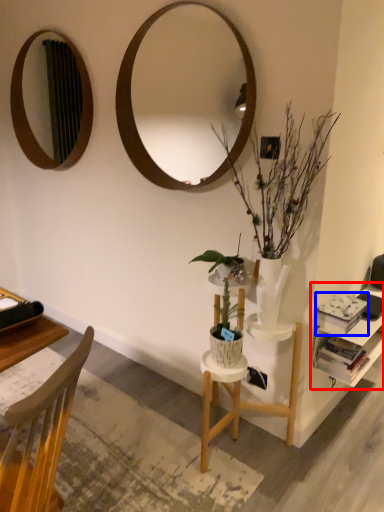
Question: Among these objects, which one is nearest to the camera, shelf (highlighted by a red box) or book (highlighted by a blue box)?

Choices:
 (A) shelf
 (B) book

Answer: (B)